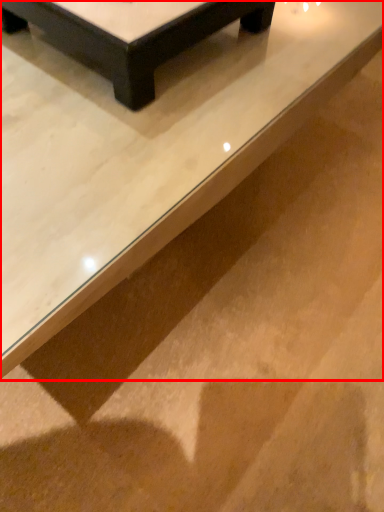
Question: From the image's perspective, where is table (annotated by the red box) located in relation to table in the image?

Choices:
 (A) below
 (B) above

Answer: (A)